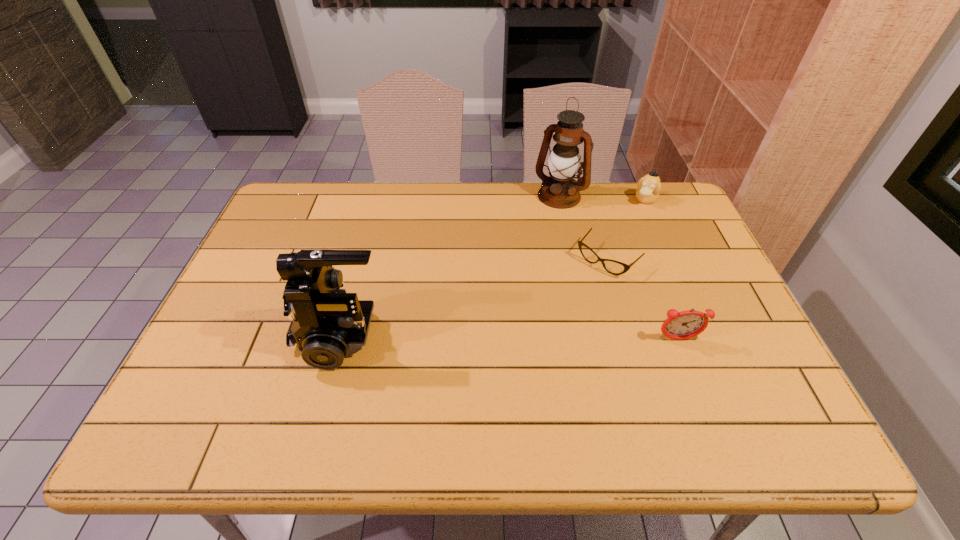
This screenshot has width=960, height=540. I want to click on lantern situated at the far edge, so click(x=559, y=190).

This screenshot has width=960, height=540. What are the coordinates of `object present at the near edge` in the screenshot? It's located at (327, 323).

At what (x,y) coordinates should I click in order to perform the action: click on alarm clock present at the right edge. Please return your answer as a coordinate pair (x, y). This screenshot has height=540, width=960. Looking at the image, I should click on (682, 325).

Where is `duckling that is at the right edge`? The height and width of the screenshot is (540, 960). duckling that is at the right edge is located at coordinates (649, 186).

I want to click on object located in the far right corner section of the desktop, so click(649, 186).

Identify the location of vacant space at the far edge. Image resolution: width=960 pixels, height=540 pixels. (437, 185).

In the image, there is a desktop. Find the location of `vacant space at the left edge`. vacant space at the left edge is located at coordinates (238, 306).

You are a GUI agent. You are given a task and a screenshot of the screen. Output one action in this format:
    pyautogui.click(x=<x>, y=<y>)
    Task: Click on the free space at the right edge of the desktop
    This screenshot has width=960, height=540.
    Given the screenshot: What is the action you would take?
    pyautogui.click(x=667, y=265)

This screenshot has height=540, width=960. I want to click on vacant space at the far left corner, so click(x=289, y=199).

At what (x,y) coordinates should I click in order to perform the action: click on free spot at the near left corner of the desktop. Please return your answer as a coordinate pair (x, y). This screenshot has width=960, height=540. Looking at the image, I should click on (251, 368).